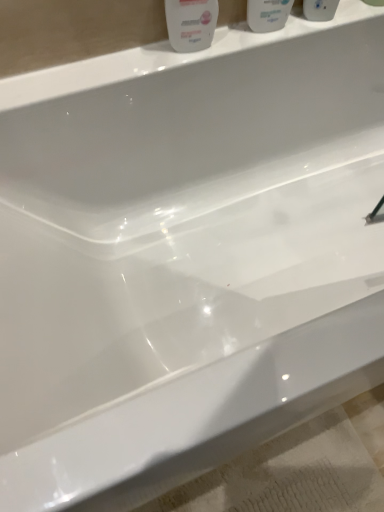
The height and width of the screenshot is (512, 384). Find the location of `vacant space to the right of white glossy bottle at upper center`. vacant space to the right of white glossy bottle at upper center is located at coordinates (239, 42).